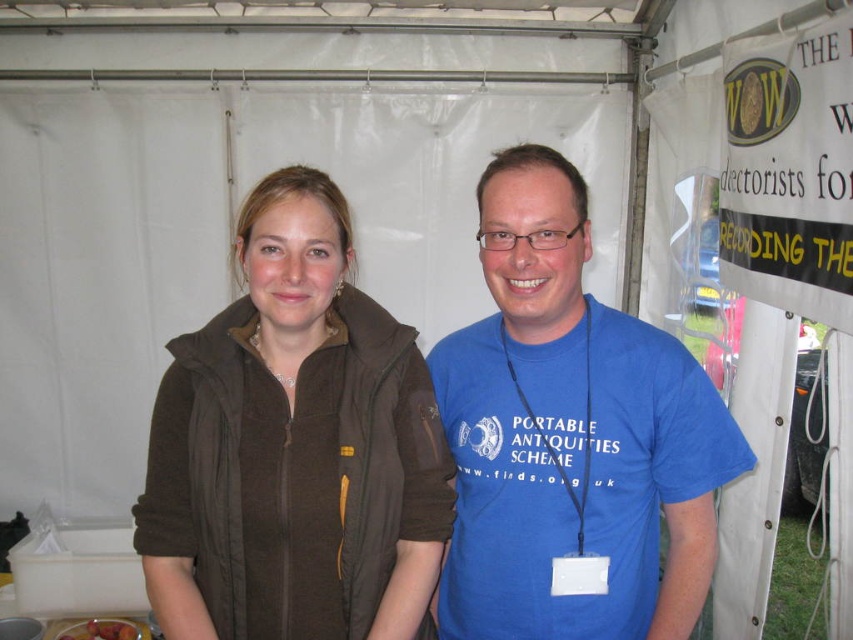
In the scene shown: You are a photographer standing 1.5 meters away from the subject. You want to take a close portrait of the brown fleece jacket at center without moving the subject. Is the jacket within your camera lens range if the minimum focusing distance is 1 meter?

The brown fleece jacket at center is 1.04 meters away from the viewer. Since the minimum focusing distance is 1 meter, the camera can focus on the jacket as it is just slightly beyond the minimum distance.